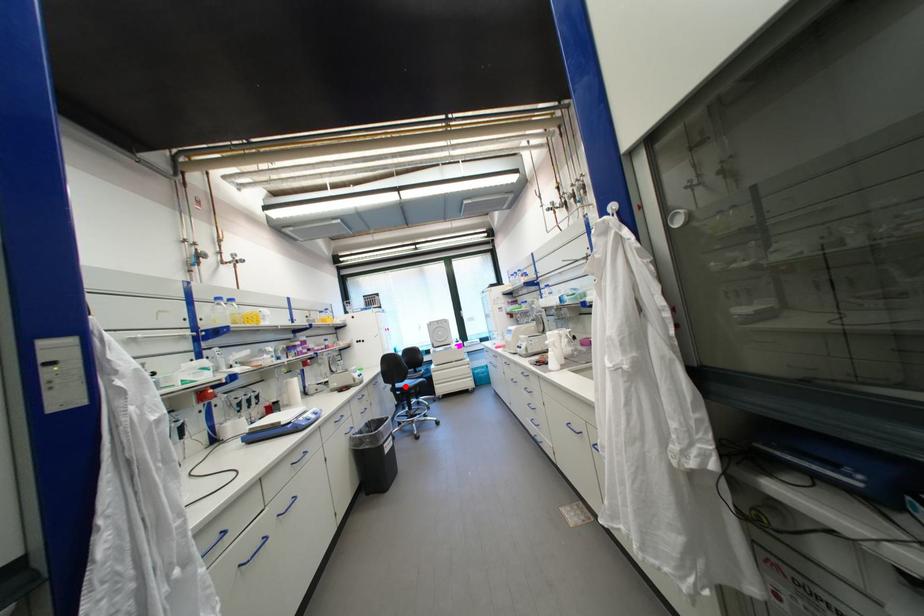
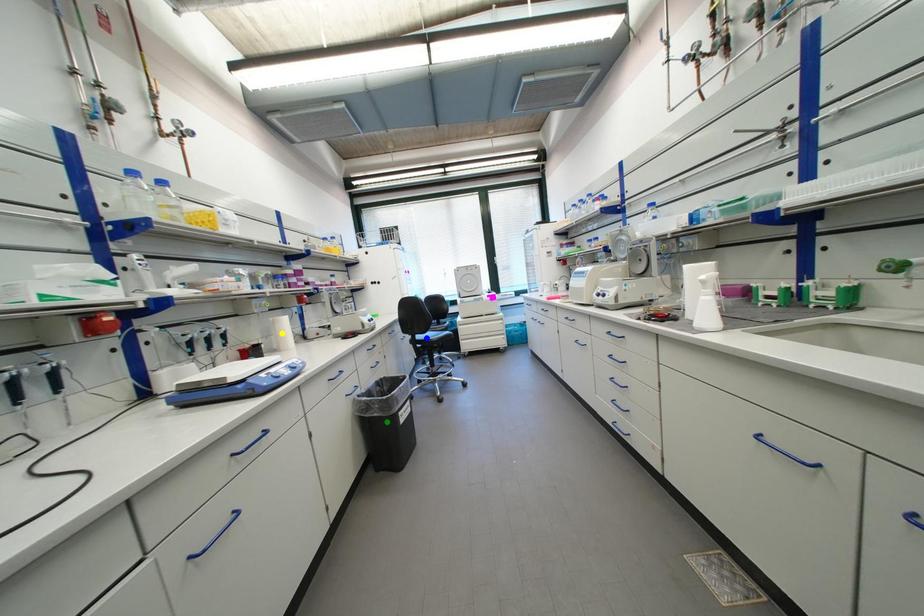
Question: I am providing you with two images of the same scene from different viewpoints. A red point is marked on the first image. You are given multiple points on the second image. Which mark in image 2 goes with the point in image 1?

Choices:
 (A) blue point
 (B) yellow point
 (C) green point

Answer: (A)